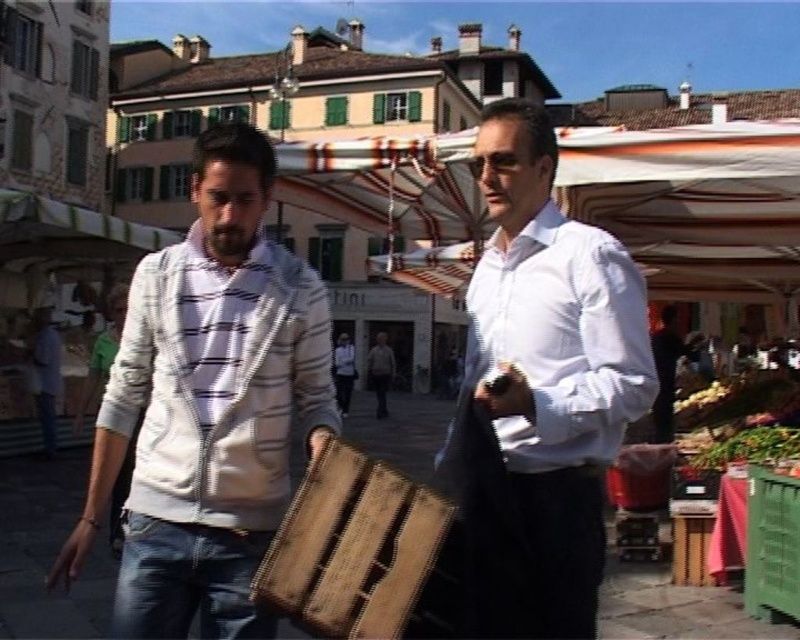
Who is higher up, white striped hoodie at center or green plastic crate at lower right?

Positioned higher is white striped hoodie at center.

Can you confirm if white striped hoodie at center is taller than green plastic crate at lower right?

Yes, white striped hoodie at center is taller than green plastic crate at lower right.

Who is more distant from viewer, (124,369) or (788,497)?

The point (788,497) is behind.

Where is `white striped hoodie at center`? white striped hoodie at center is located at coordinates (208, 404).

Which is more to the left, white striped hoodie at center or wooden crate at center?

From the viewer's perspective, white striped hoodie at center appears more on the left side.

The width and height of the screenshot is (800, 640). What are the coordinates of `white striped hoodie at center` in the screenshot? It's located at (208, 404).

Between point (272, 440) and point (314, 572), which one is positioned in front?

Point (314, 572) is more forward.

Find the location of a particular element. white striped hoodie at center is located at coordinates (208, 404).

In the scene shown: Does white striped awning at center have a smaller size compared to green plastic crate at lower right?

Actually, white striped awning at center might be larger than green plastic crate at lower right.

What do you see at coordinates (692, 204) in the screenshot? Image resolution: width=800 pixels, height=640 pixels. I see `white striped awning at center` at bounding box center [692, 204].

This screenshot has height=640, width=800. I want to click on white striped awning at center, so pos(692,204).